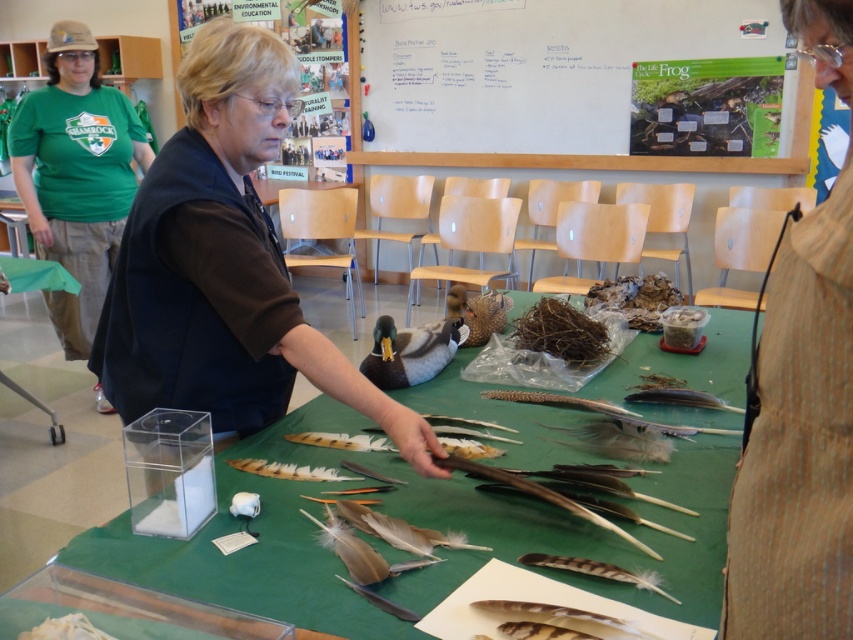
From the picture: Who is taller, brown textured jacket at upper right or green fabric shirt at upper left?

Standing taller between the two is green fabric shirt at upper left.

Which is below, brown textured jacket at upper right or green fabric shirt at upper left?

brown textured jacket at upper right is below.

Which is in front, point (808, 349) or point (45, 115)?

Positioned in front is point (808, 349).

Locate an element on the screen. The image size is (853, 640). brown textured jacket at upper right is located at coordinates (798, 444).

Who is lower down, brown feathered objects at center or matte brown duck at center?

Positioned lower is brown feathered objects at center.

Can you confirm if brown feathered objects at center is bigger than matte brown duck at center?

Correct, brown feathered objects at center is larger in size than matte brown duck at center.

Who is more forward, (444,394) or (445,328)?

Positioned in front is point (444,394).

Identify the location of brown feathered objects at center. The width and height of the screenshot is (853, 640). (300, 502).

Measure the distance between whiteboard at upper center and green fabric shirt at upper left.

They are 8.79 feet apart.

Does whiteboard at upper center appear on the right side of green fabric shirt at upper left?

Yes, whiteboard at upper center is to the right of green fabric shirt at upper left.

The height and width of the screenshot is (640, 853). What are the coordinates of `whiteboard at upper center` in the screenshot? It's located at (548, 81).

Locate an element on the screen. The image size is (853, 640). whiteboard at upper center is located at coordinates (548, 81).